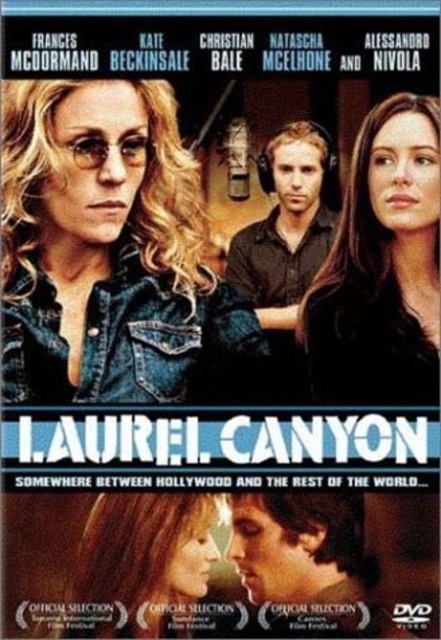
Is blonde hair at lower center to the left of brown leather shirt at center from the viewer's perspective?

Indeed, blonde hair at lower center is positioned on the left side of brown leather shirt at center.

Identify the location of blonde hair at lower center. Image resolution: width=441 pixels, height=640 pixels. (142, 563).

You are a GUI agent. You are given a task and a screenshot of the screen. Output one action in this format:
    pyautogui.click(x=<x>, y=<y>)
    Task: Click on the blonde hair at lower center
    The image size is (441, 640).
    Given the screenshot: What is the action you would take?
    pyautogui.click(x=142, y=563)

At what (x,y) coordinates should I click in order to perform the action: click on blonde hair at lower center. Please return your answer as a coordinate pair (x, y). The width and height of the screenshot is (441, 640). Looking at the image, I should click on (142, 563).

Based on the photo, can you confirm if smooth brown hair at center is shorter than smooth skin face at lower center?

No, smooth brown hair at center is not shorter than smooth skin face at lower center.

Measure the distance between point (355, 228) and camera.

Answer: The distance of point (355, 228) from camera is 111.49 feet.

At what (x,y) coordinates should I click in order to perform the action: click on smooth brown hair at center. Please return your answer as a coordinate pair (x, y). Image resolution: width=441 pixels, height=640 pixels. Looking at the image, I should click on (381, 266).

Between smooth brown hair at center and brown leather shirt at center, which one has more height?

smooth brown hair at center is taller.

Consider the image. How much distance is there between smooth brown hair at center and brown leather shirt at center?

They are 8.59 feet apart.

Between point (437, 216) and point (283, 234), which one is positioned in front?

Point (437, 216) is in front.

Where is `smooth brown hair at center`? smooth brown hair at center is located at coordinates (381, 266).